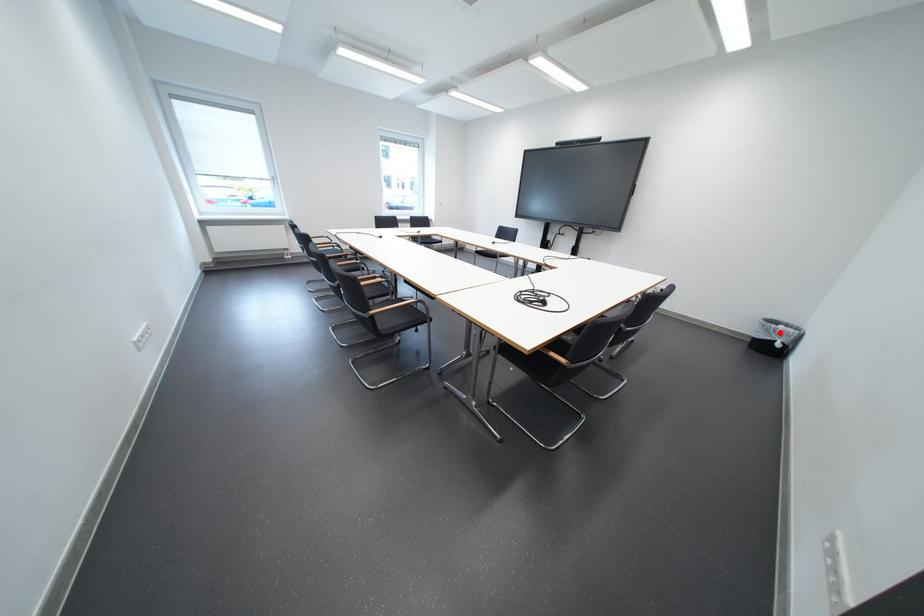
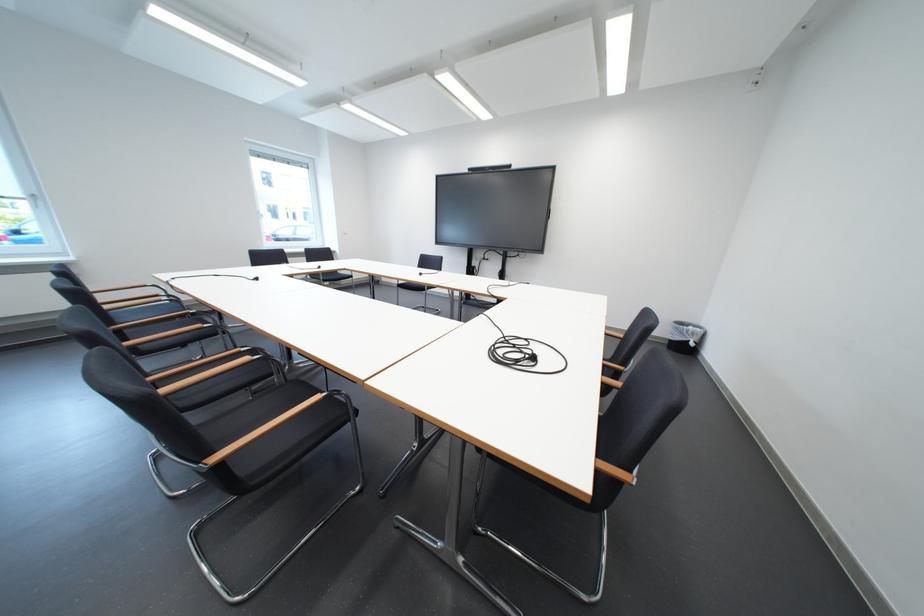
Find the pixel in the second image that matches the highlighted location in the first image.

(694, 334)